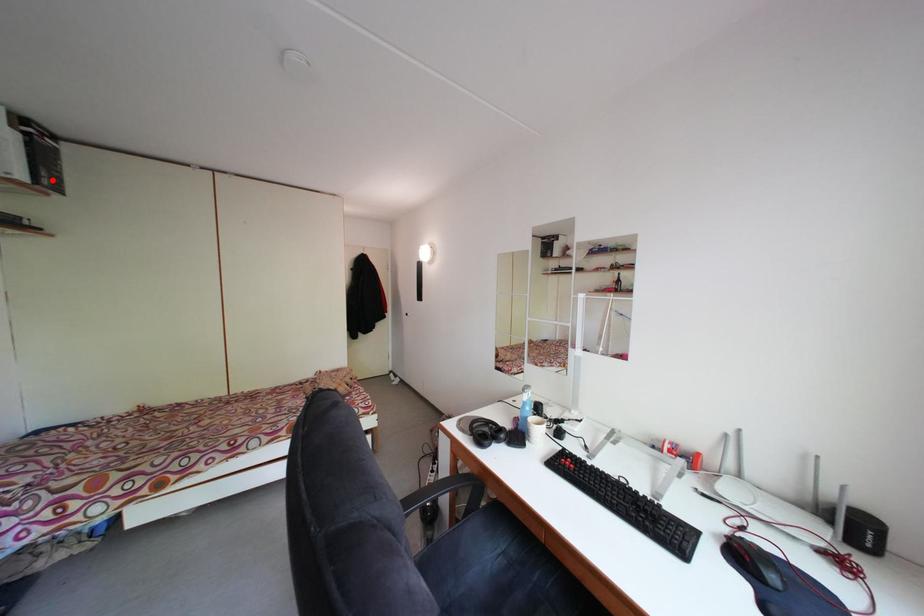
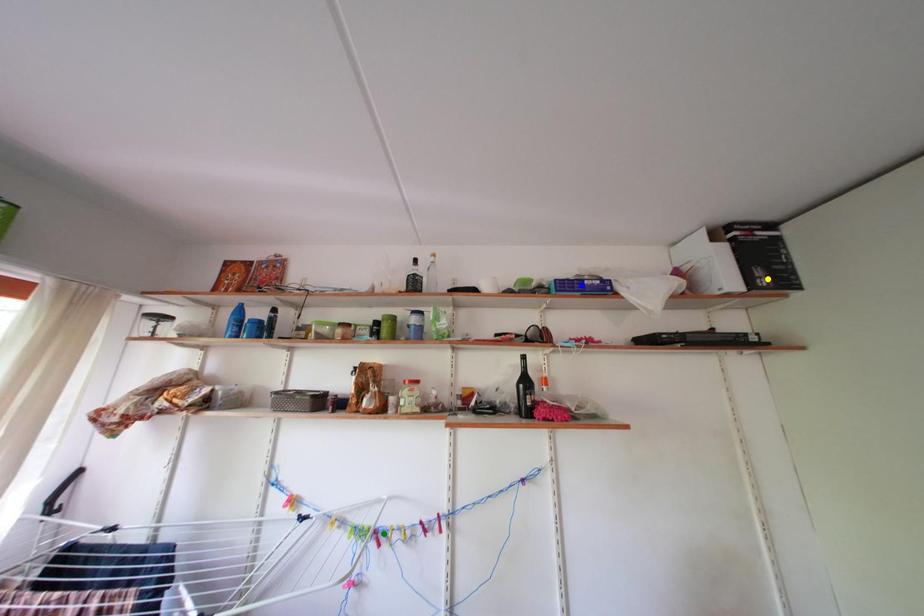
Question: I am providing you with two images of the same scene from different viewpoints. A red point is marked on the first image. You are given multiple points on the second image. In image 2, which mark is for the same physical point as the one in image 1?

Choices:
 (A) yellow point
 (B) blue point
 (C) green point

Answer: (A)